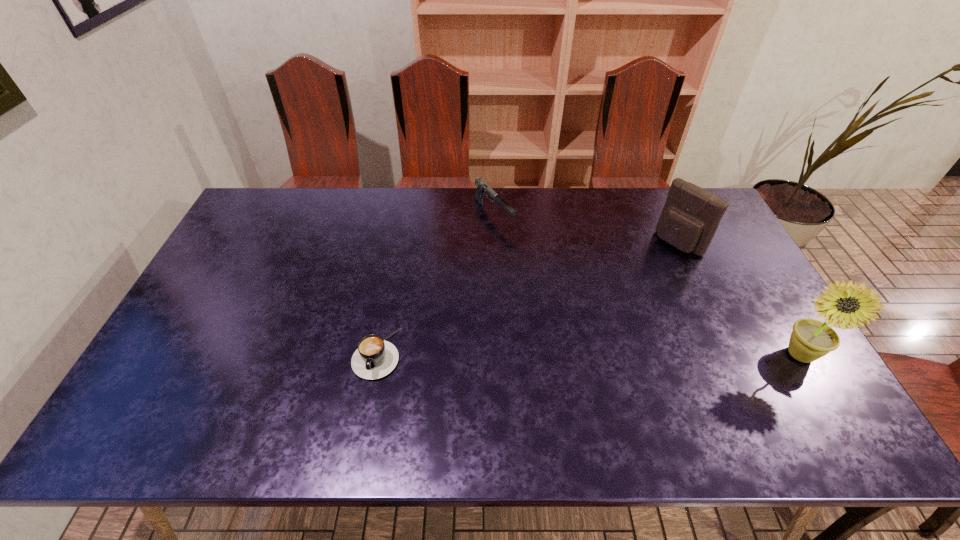
Locate an element on the screen. This screenshot has height=540, width=960. free location located at the muzzle end of the gun is located at coordinates (571, 298).

Locate an element on the screen. Image resolution: width=960 pixels, height=540 pixels. vacant point located at the muzzle end of the gun is located at coordinates (516, 243).

Identify the location of vacant space located 0.340m with an open flap on the second object from right to left. (598, 306).

Where is `vacant space located 0.120m with an open flap on the second object from right to left`? The width and height of the screenshot is (960, 540). vacant space located 0.120m with an open flap on the second object from right to left is located at coordinates (644, 270).

At what (x,y) coordinates should I click in order to perform the action: click on blank area located 0.310m with an open flap on the second object from right to left. Please return your answer as a coordinate pair (x, y). Looking at the image, I should click on (605, 300).

The image size is (960, 540). I want to click on gun located in the far edge section of the desktop, so click(483, 189).

Identify the location of pouch located in the far edge section of the desktop. The height and width of the screenshot is (540, 960). (691, 215).

This screenshot has height=540, width=960. What are the coordinates of `cappuccino at the near edge` in the screenshot? It's located at (375, 358).

Locate an element on the screen. This screenshot has width=960, height=540. sunflower that is at the near edge is located at coordinates (811, 339).

Locate an element on the screen. sunflower that is at the right edge is located at coordinates (811, 339).